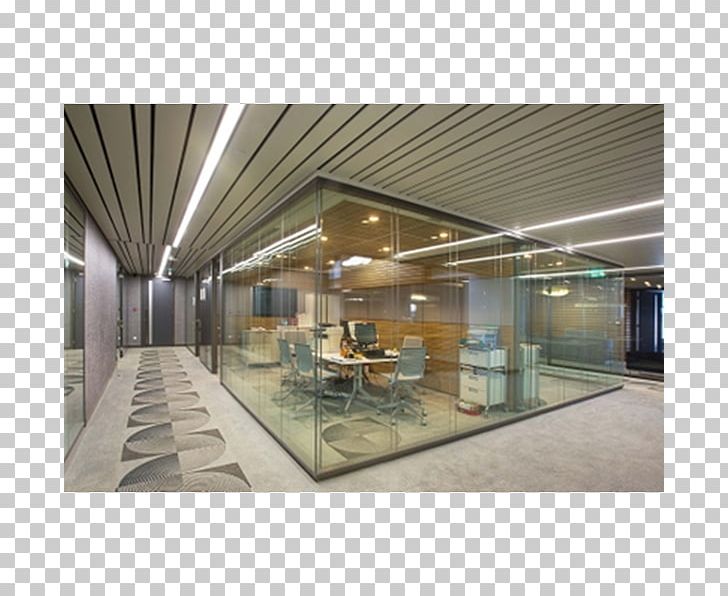
At what (x,y) coordinates should I click in order to perform the action: click on glass. Please return your answer as a coordinate pair (x, y). Image resolution: width=728 pixels, height=596 pixels. Looking at the image, I should click on (229, 364), (290, 290), (346, 241), (360, 318), (464, 322), (523, 338), (603, 355).